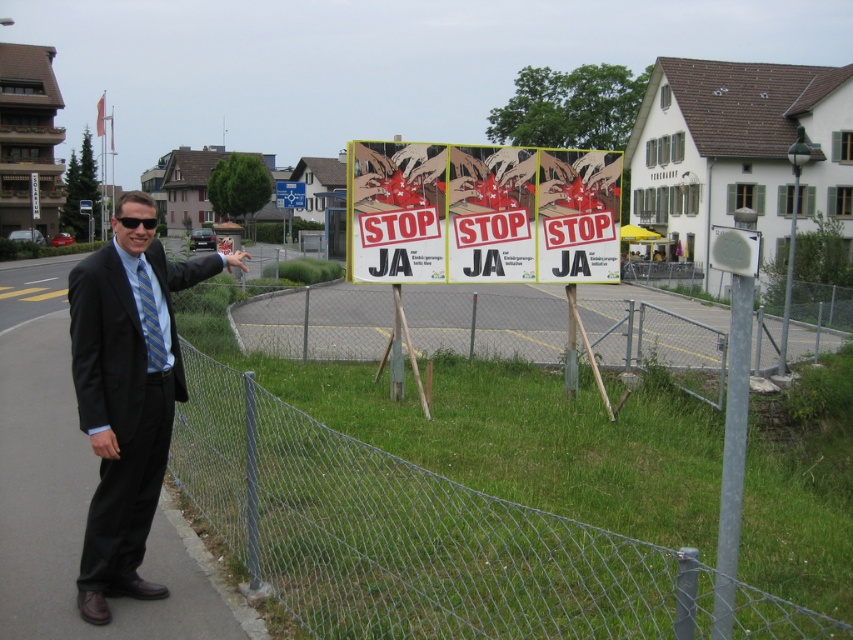
Is point (608, 550) positioned behind point (140, 310)?

Yes, point (608, 550) is farther from viewer.

The image size is (853, 640). Find the location of `wire mesh fence at lower left`. wire mesh fence at lower left is located at coordinates (433, 548).

Does wire mesh fence at lower left appear over matte paper poster at center?

No, wire mesh fence at lower left is not above matte paper poster at center.

Does point (706, 625) lie in front of point (590, 278)?

Yes.

Which is behind, point (245, 534) or point (413, 173)?

Point (413, 173)

Locate an element on the screen. wire mesh fence at lower left is located at coordinates tap(433, 548).

Who is more forward, (117, 317) or (152, 332)?

Point (117, 317) is more forward.

This screenshot has height=640, width=853. Identify the location of black suit at left. (125, 404).

Where is `black suit at left`? The width and height of the screenshot is (853, 640). black suit at left is located at coordinates (125, 404).

Identify the location of black suit at left. (125, 404).